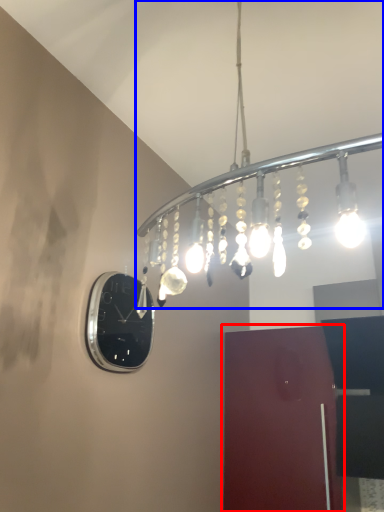
Question: Among these objects, which one is nearest to the camera, door (highlighted by a red box) or lamp (highlighted by a blue box)?

Choices:
 (A) door
 (B) lamp

Answer: (B)